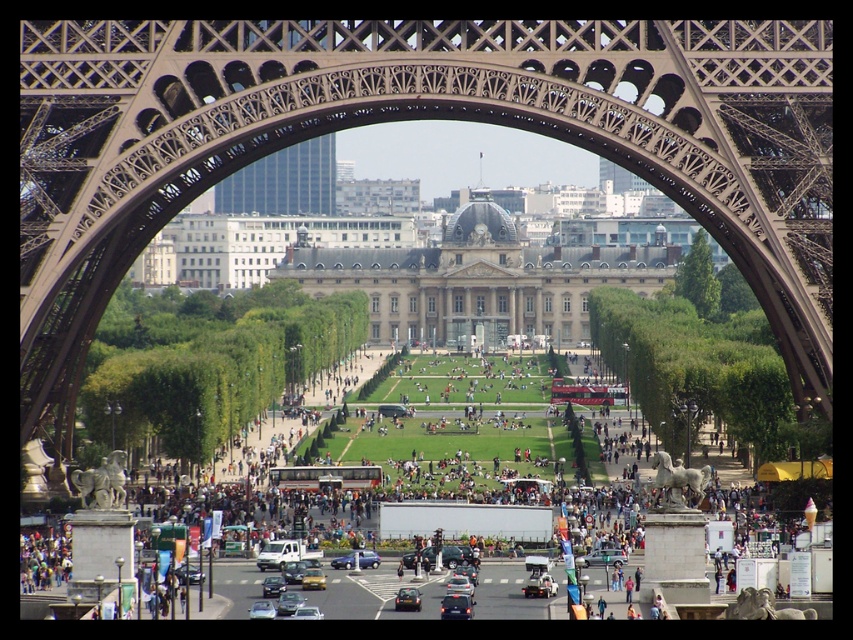
In the scene shown: You are a tourist standing at the base of the metallic brown eiffel tower at center and want to take a photo of the metallic blue sedan at center. Which object should you focus on first to ensure both are in the frame?

You should focus on the metallic brown eiffel tower at center first because it is much taller than the metallic blue sedan at center, so you need to adjust your camera angle to include its full height while still capturing the sedan in the shot.

You are standing at the base of the Eiffel Tower and want to take a photo that includes both the metallic brown eiffel tower at center and the metallic blue sedan at center. Since you want the Eiffel Tower to appear larger in the photo than the sedan, which object should you move closer to?

To make the metallic brown eiffel tower at center appear larger than the metallic blue sedan at center in the photo, you should move closer to the metallic brown eiffel tower at center since it is already closer to the viewer than the sedan.

You are a photographer planning to take a wide shot of the metallic brown eiffel tower at center and the metallic blue sedan at center from the same position. Based on their sizes, which object will appear wider in the photo?

The metallic brown eiffel tower at center will appear wider in the photo because its width is larger than the metallic blue sedan at center according to the description.